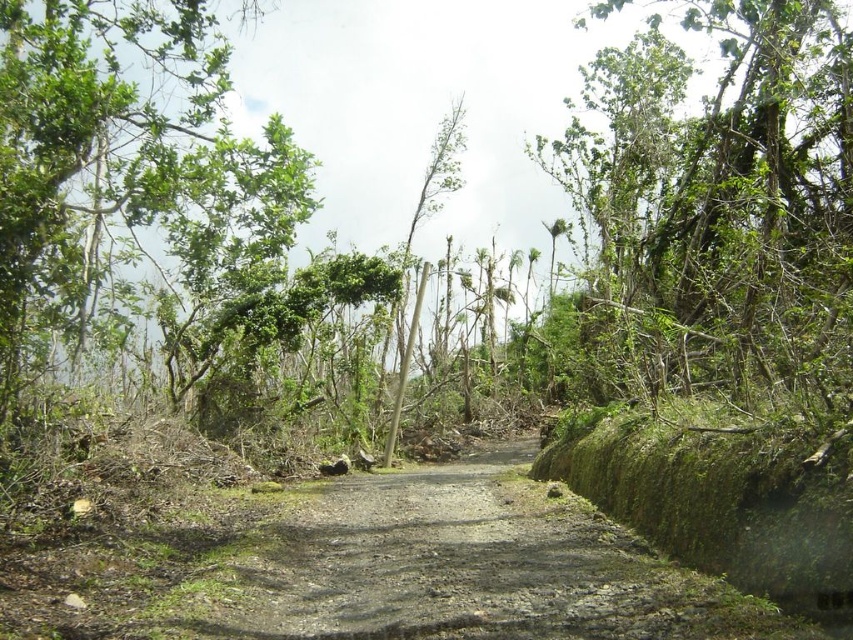
Is green leafy tree at upper right behind green leafy tree at upper left?

No, it is in front of green leafy tree at upper left.

Is point (651, 189) positioned behind point (193, 99)?

Yes, it is behind point (193, 99).

Image resolution: width=853 pixels, height=640 pixels. I want to click on green leafy tree at upper right, so click(723, 202).